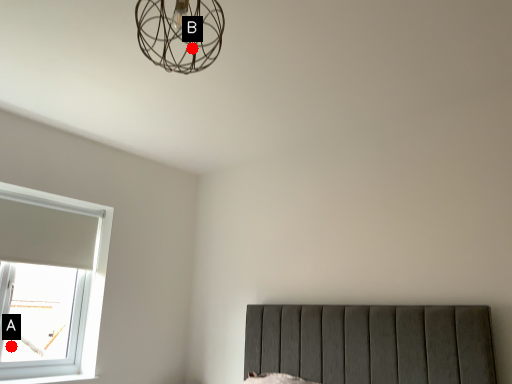
Question: Two points are circled on the image, labeled by A and B beside each circle. Which point appears farthest from the camera in this image?

Choices:
 (A) A is further
 (B) B is further

Answer: (A)